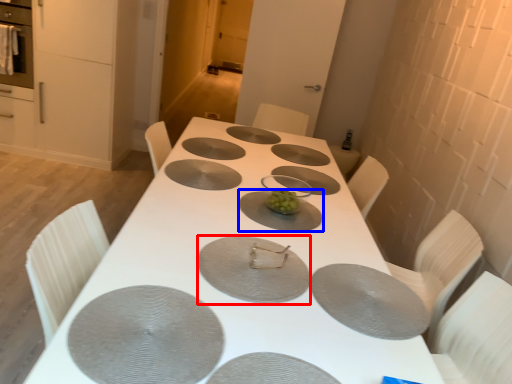
Question: Which point is further to the camera, pizza pan (highlighted by a red box) or platter (highlighted by a blue box)?

Choices:
 (A) pizza pan
 (B) platter

Answer: (B)